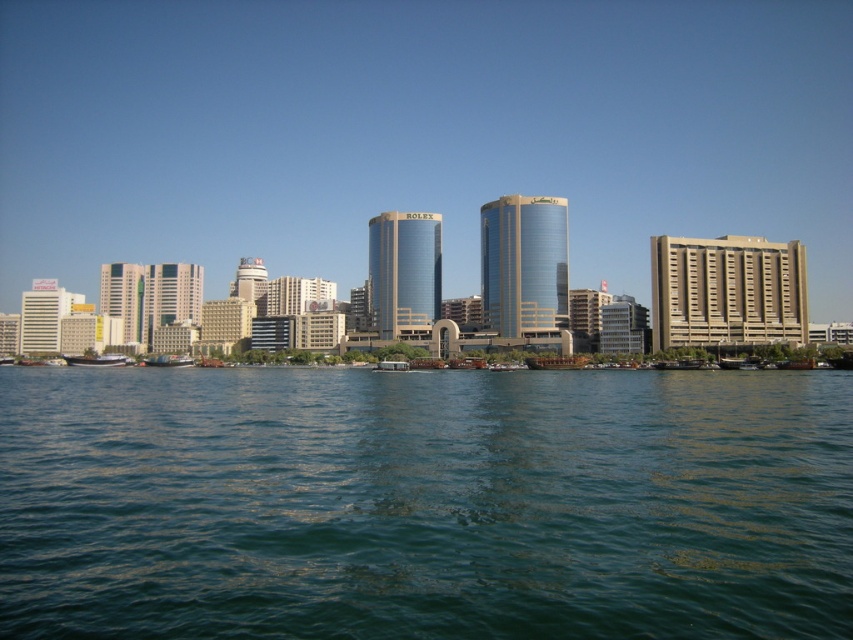
Question: Among these objects, which one is farthest from the camera?

Choices:
 (A) green plastic boat at lower left
 (B) greenish-blue water at center
 (C) white glossy boat at lower left

Answer: (C)

Question: Is metallic silver boat at center to the right of wooden planks boat at center from the viewer's perspective?

Choices:
 (A) no
 (B) yes

Answer: (A)

Question: Estimate the real-world distances between objects in this image. Which object is closer to the metallic silver boat at center?

Choices:
 (A) green plastic boat at lower left
 (B) greenish-blue water at center
 (C) white glossy boat at lower left
 (D) wooden planks boat at center

Answer: (D)

Question: Does white glossy boat at lower left have a lesser width compared to green plastic boat at lower left?

Choices:
 (A) no
 (B) yes

Answer: (A)

Question: Estimate the real-world distances between objects in this image. Which object is closer to the wooden planks boat at center?

Choices:
 (A) white glossy boat at lower left
 (B) metallic silver boat at center
 (C) green plastic boat at lower left

Answer: (B)

Question: Is greenish-blue water at center smaller than wooden planks boat at center?

Choices:
 (A) yes
 (B) no

Answer: (B)